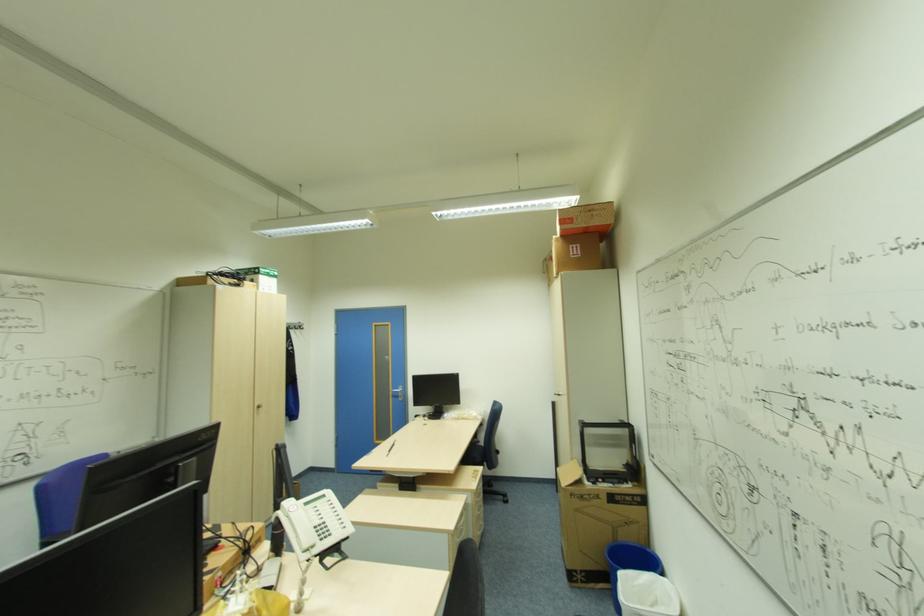
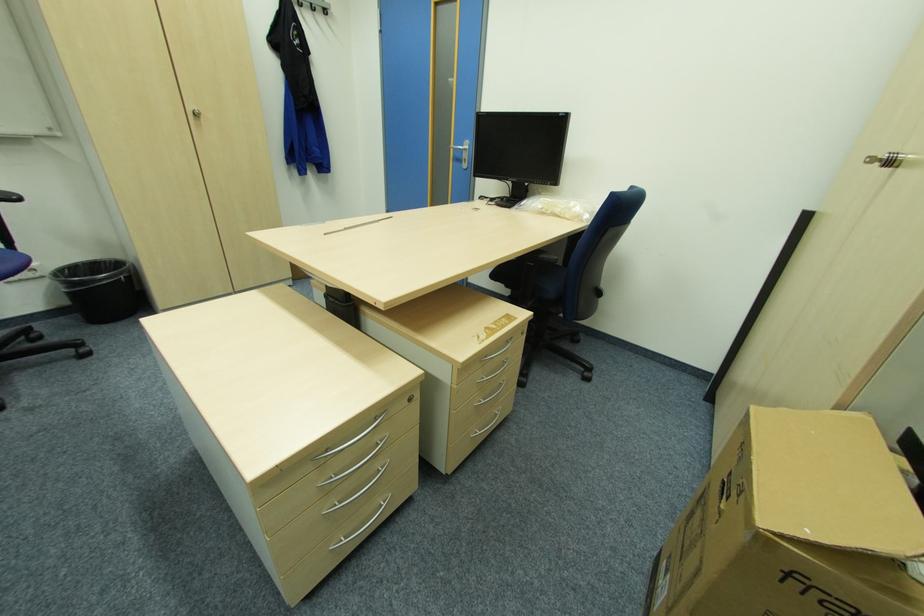
In the second image, find the point that corresponds to pixel 574 496 in the first image.

(789, 573)